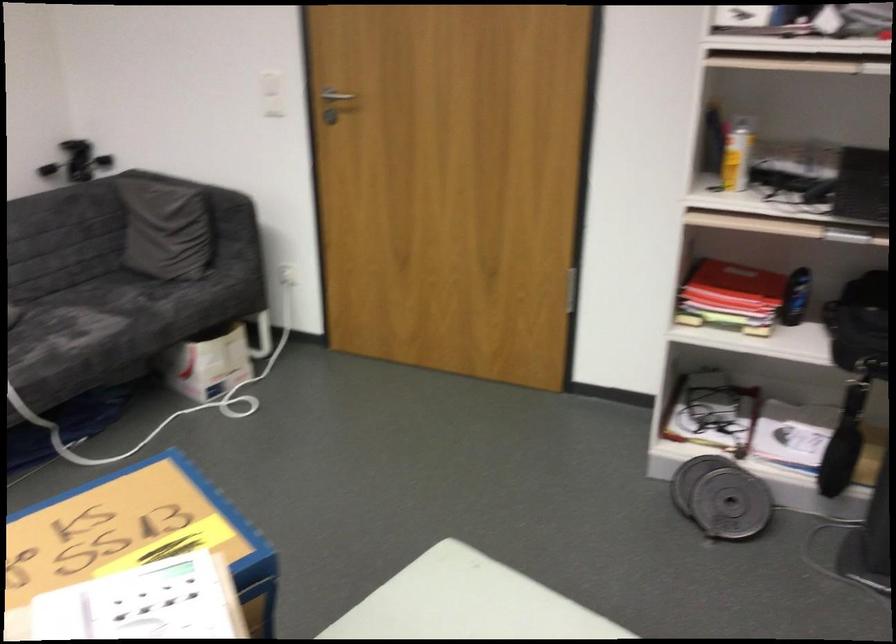
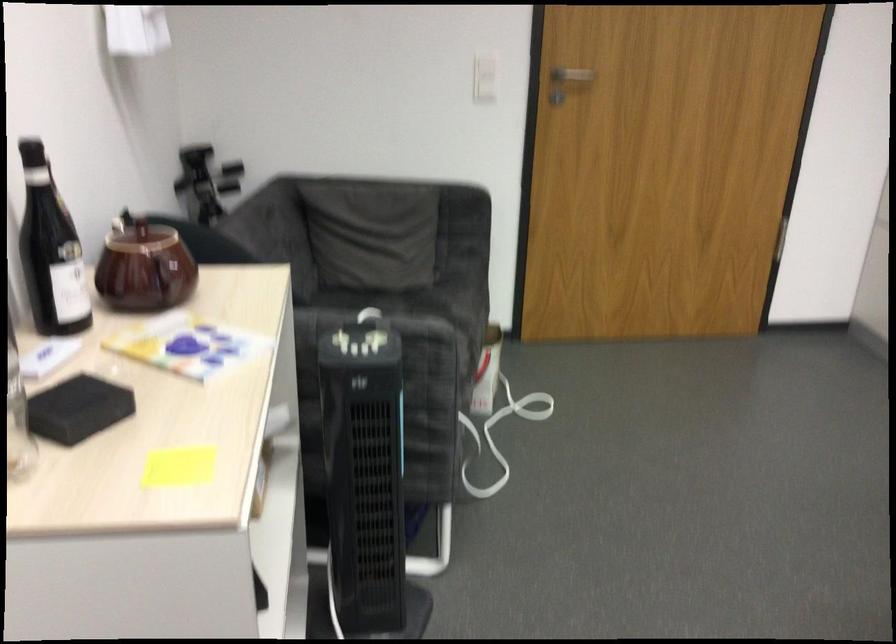
Find the pixel in the second image that matches (x=131, y=325) in the first image.

(460, 335)